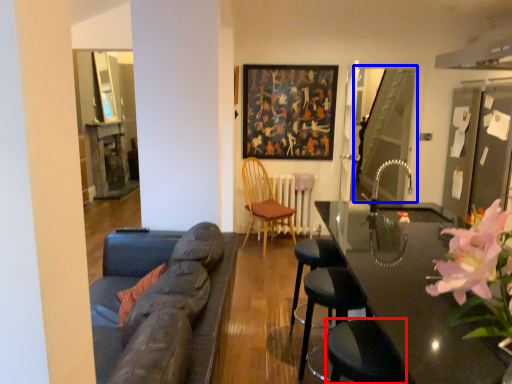
Question: Which object appears closest to the camera in this image, swivel chair (highlighted by a red box) or glass door (highlighted by a blue box)?

Choices:
 (A) swivel chair
 (B) glass door

Answer: (A)